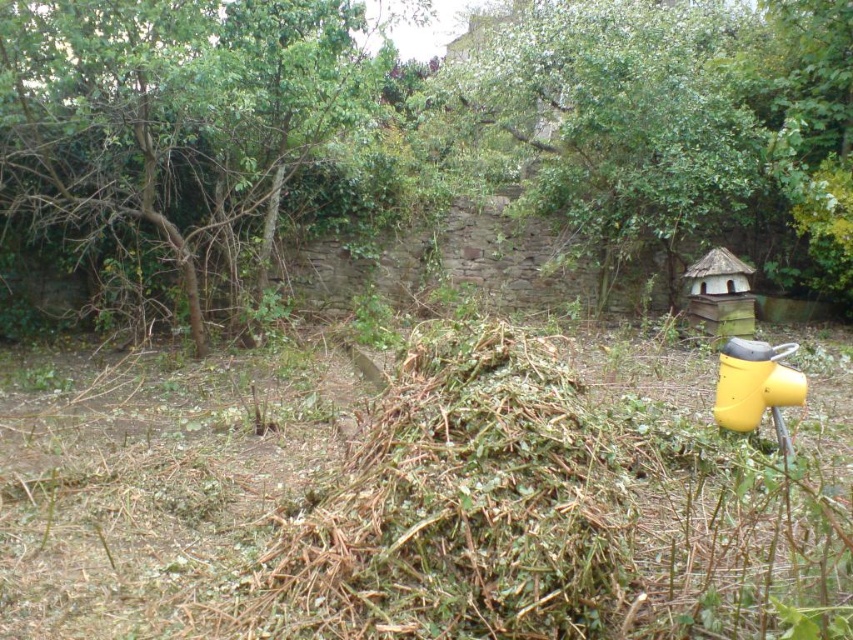
Question: Can you confirm if green leafy tree at upper left is smaller than green leafy tree at upper center?

Choices:
 (A) no
 (B) yes

Answer: (B)

Question: Which point is closer to the camera taking this photo?

Choices:
 (A) (250, 141)
 (B) (711, 320)
 (C) (485, 83)

Answer: (A)

Question: Which object appears closest to the camera in this image?

Choices:
 (A) green leafy tree at upper left
 (B) wooden hut at right

Answer: (A)

Question: Which point is farther to the camera?

Choices:
 (A) (144, 182)
 (B) (775, 376)

Answer: (A)

Question: Is yellow plastic hydrant at lower right to the right of wooden hut at right from the viewer's perspective?

Choices:
 (A) yes
 (B) no

Answer: (B)

Question: Can you confirm if green leafy tree at upper center is bigger than yellow plastic hydrant at lower right?

Choices:
 (A) no
 (B) yes

Answer: (B)